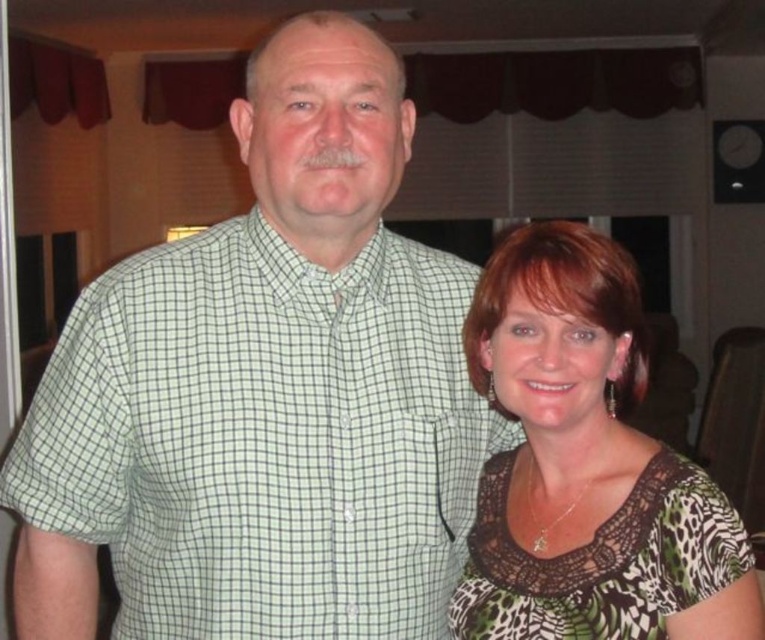
Is green checkered shirt at center to the right of printed fabric blouse at right from the viewer's perspective?

Incorrect, green checkered shirt at center is not on the right side of printed fabric blouse at right.

Is green checkered shirt at center bigger than printed fabric blouse at right?

No, green checkered shirt at center is not bigger than printed fabric blouse at right.

This screenshot has height=640, width=765. What do you see at coordinates (264, 436) in the screenshot?
I see `green checkered shirt at center` at bounding box center [264, 436].

Image resolution: width=765 pixels, height=640 pixels. I want to click on green checkered shirt at center, so click(264, 436).